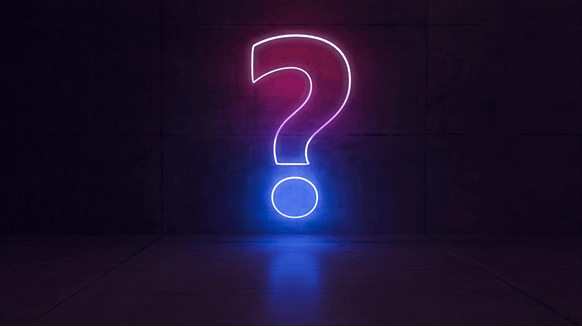
Identify the location of line between wall blocks. The height and width of the screenshot is (327, 582). (428, 93).